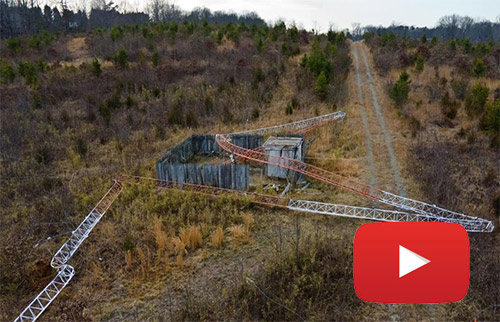
You are a GUI agent. You are given a task and a screenshot of the screen. Output one action in this format:
    pyautogui.click(x=<x>, y=<y>)
    Task: Click on the wooden structure
    The height and width of the screenshot is (322, 500).
    Given the screenshot: What is the action you would take?
    pyautogui.click(x=279, y=150)